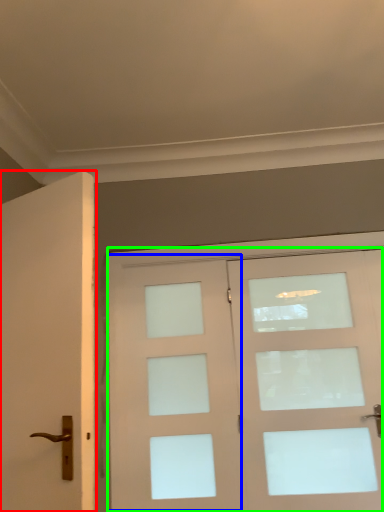
Question: Which object is positioned farthest from door (highlighted by a red box)? Select from screen door (highlighted by a blue box) and door (highlighted by a green box).

Choices:
 (A) screen door
 (B) door

Answer: (B)